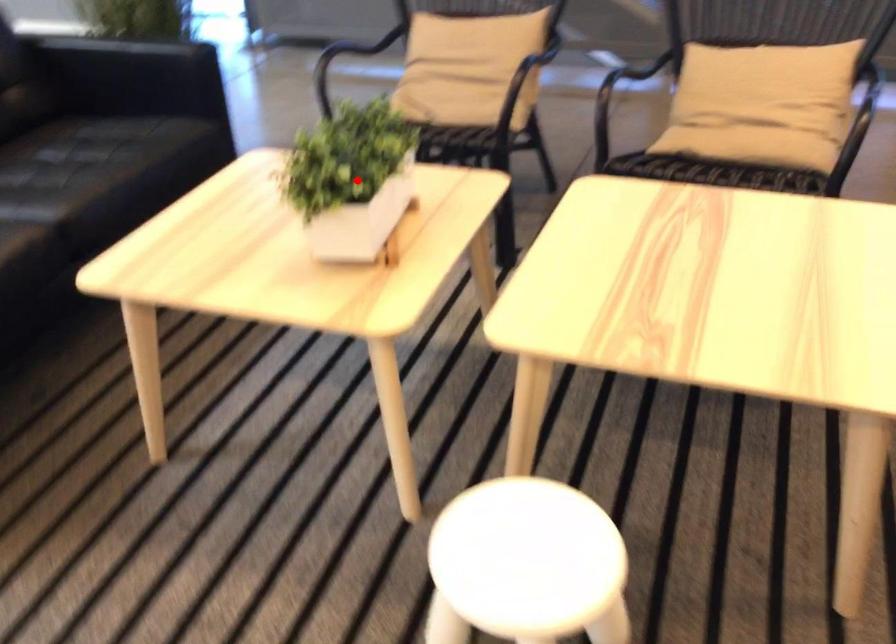
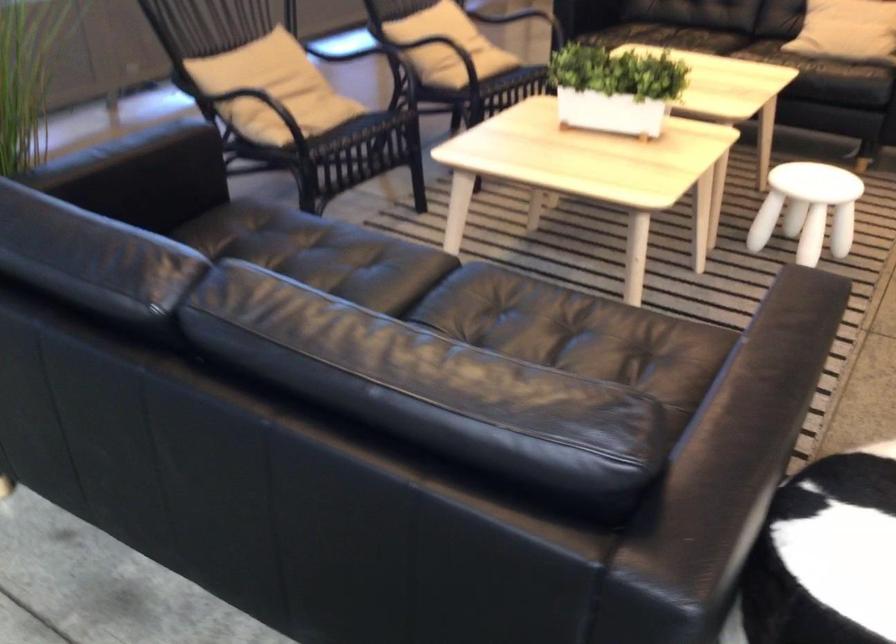
Question: I am providing you with two images of the same scene from different viewpoints. A red point is shown in image1. For the corresponding object point in image2, is it positioned nearer or farther from the camera?

Choices:
 (A) Nearer
 (B) Farther

Answer: (B)